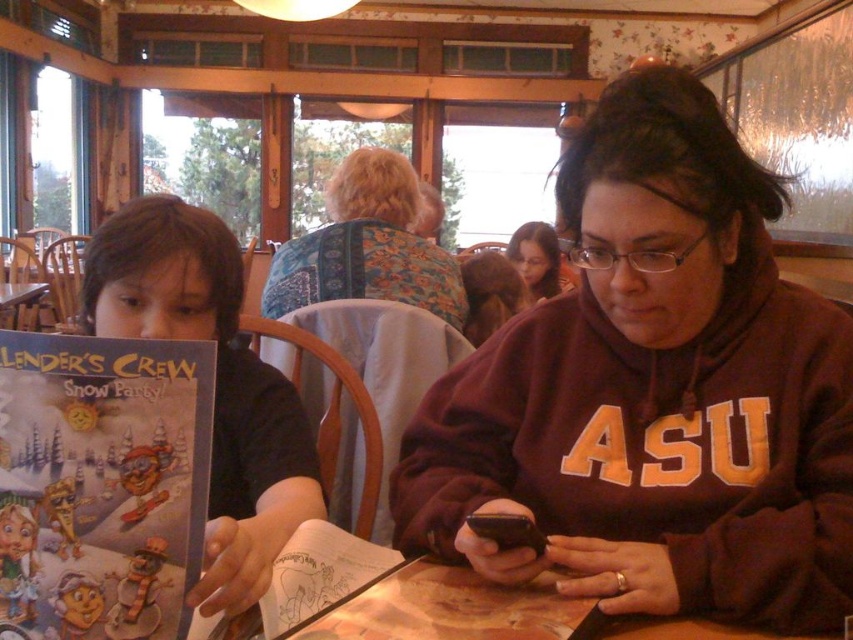
Is matte paper book at center bigger than matte brown hair at upper center?

Incorrect, matte paper book at center is not larger than matte brown hair at upper center.

Can you confirm if matte paper book at center is smaller than matte brown hair at upper center?

Yes, matte paper book at center is smaller than matte brown hair at upper center.

Does point (300, 563) come closer to viewer compared to point (523, 276)?

Yes, it is in front of point (523, 276).

The image size is (853, 640). I want to click on matte paper book at center, so click(318, 573).

Does wooden table at center come in front of floral fabric shawl at upper center?

Yes.

Does point (509, 586) come closer to viewer compared to point (323, 285)?

Yes, point (509, 586) is in front of point (323, 285).

Describe the element at coordinates (495, 612) in the screenshot. I see `wooden table at center` at that location.

The width and height of the screenshot is (853, 640). Identify the location of wooden table at center. (495, 612).

Between matte paper book at center and black matte smartphone at center, which one has less height?

With less height is black matte smartphone at center.

Which is below, matte paper book at center or black matte smartphone at center?

matte paper book at center is below.

Locate an element on the screen. matte paper book at center is located at coordinates (318, 573).